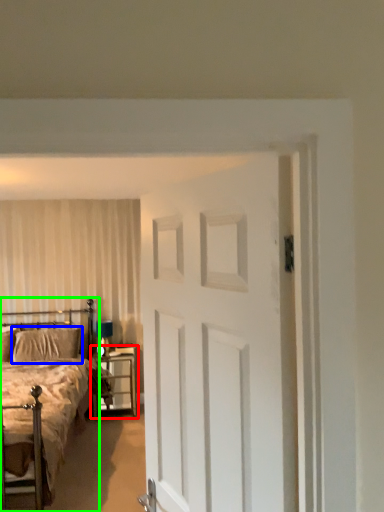
Question: Which object is positioned farthest from nightstand (highlighted by a red box)? Select from pillow (highlighted by a blue box) and bed (highlighted by a green box).

Choices:
 (A) pillow
 (B) bed

Answer: (B)